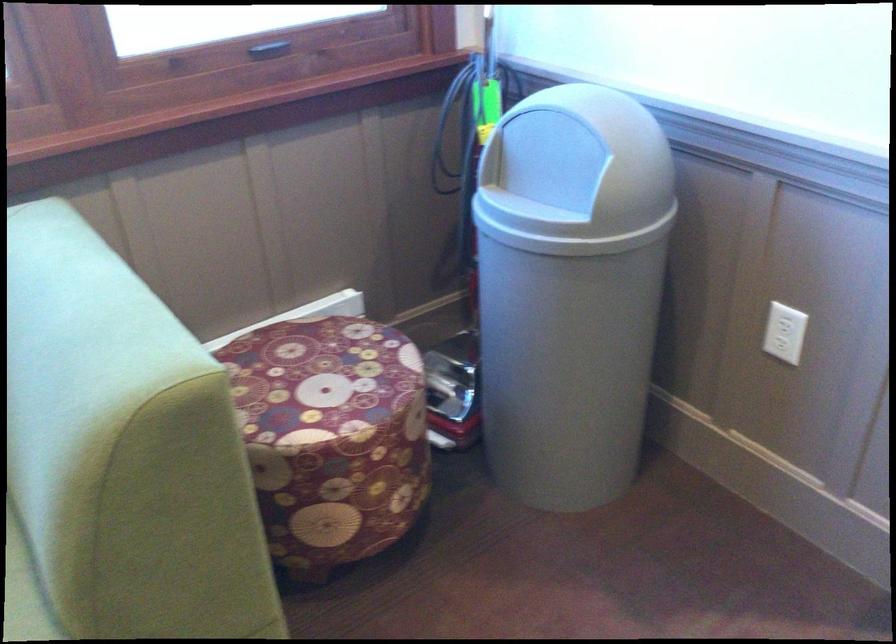
Image resolution: width=896 pixels, height=644 pixels. Describe the element at coordinates (320, 373) in the screenshot. I see `the patterned fabric stool` at that location.